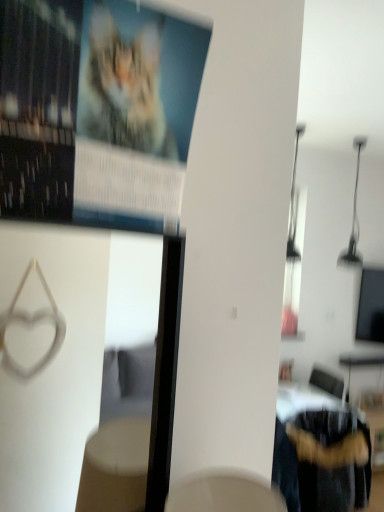
Question: From the image's perspective, relative to fuzzy fabric chair at lower right, is matte paper poster at upper left above or below?

Choices:
 (A) below
 (B) above

Answer: (B)

Question: Considering the positions of matte paper poster at upper left and fuzzy fabric chair at lower right in the image, is matte paper poster at upper left taller or shorter than fuzzy fabric chair at lower right?

Choices:
 (A) short
 (B) tall

Answer: (A)

Question: Is matte paper poster at upper left wider or thinner than fuzzy fabric chair at lower right?

Choices:
 (A) wide
 (B) thin

Answer: (B)

Question: Considering the relative positions of fuzzy fabric chair at lower right and matte paper poster at upper left in the image provided, is fuzzy fabric chair at lower right to the left or to the right of matte paper poster at upper left?

Choices:
 (A) right
 (B) left

Answer: (A)

Question: Is fuzzy fabric chair at lower right taller or shorter than matte paper poster at upper left?

Choices:
 (A) tall
 (B) short

Answer: (A)

Question: From the image's perspective, is fuzzy fabric chair at lower right above or below matte paper poster at upper left?

Choices:
 (A) below
 (B) above

Answer: (A)

Question: Looking at their shapes, would you say fuzzy fabric chair at lower right is wider or thinner than matte paper poster at upper left?

Choices:
 (A) thin
 (B) wide

Answer: (B)